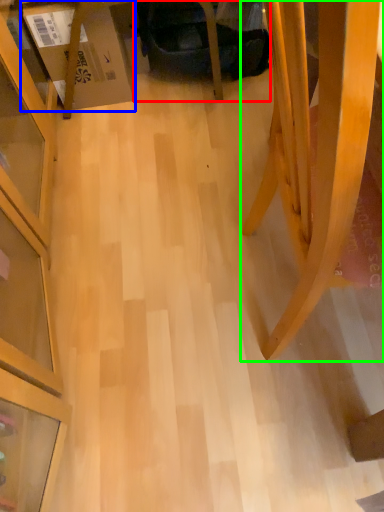
Question: Considering the real-world distances, which object is farthest from swivel chair (highlighted by a red box)? cardboard box (highlighted by a blue box) or furniture (highlighted by a green box)?

Choices:
 (A) cardboard box
 (B) furniture

Answer: (B)